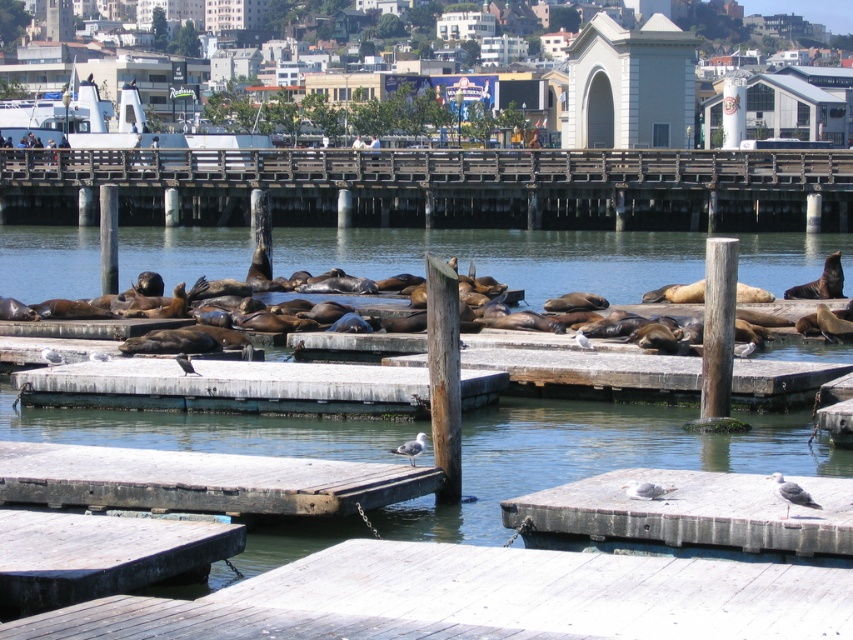
Looking at this image, is wooden at center thinner than wooden dock at center?

Incorrect, wooden at center's width is not less than wooden dock at center's.

Is wooden at center above wooden dock at center?

Correct, wooden at center is located above wooden dock at center.

Image resolution: width=853 pixels, height=640 pixels. I want to click on wooden at center, so click(445, 186).

Does point (410, 481) lie in front of point (334, 392)?

Yes, point (410, 481) is closer to viewer.

Looking at this image, between wooden dock at center and smooth concrete dock at center, which one has more height?

wooden dock at center

Describe the element at coordinates (201, 481) in the screenshot. The height and width of the screenshot is (640, 853). I see `wooden dock at center` at that location.

Where is `wooden dock at center`? This screenshot has width=853, height=640. wooden dock at center is located at coordinates click(201, 481).

Can you confirm if brown wooden water at center is wider than concrete gray dock at lower right?

Correct, the width of brown wooden water at center exceeds that of concrete gray dock at lower right.

Does brown wooden water at center appear under concrete gray dock at lower right?

No.

Is point (366, 252) farther from viewer compared to point (715, 516)?

Yes, point (366, 252) is behind point (715, 516).

Locate an element on the screen. brown wooden water at center is located at coordinates (596, 456).